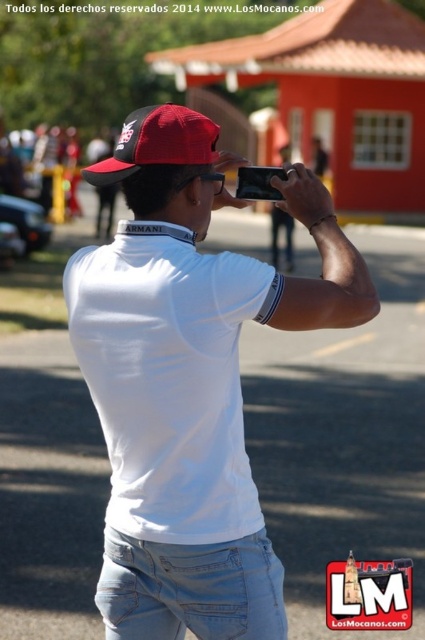
You are a fashion designer analyzing the man in the image. Which clothing item is covering the other one, the white matte shirt at center or the light blue denim jeans at center?

The white matte shirt at center is positioned over light blue denim jeans at center, so the white matte shirt at center is covering the light blue denim jeans at center.